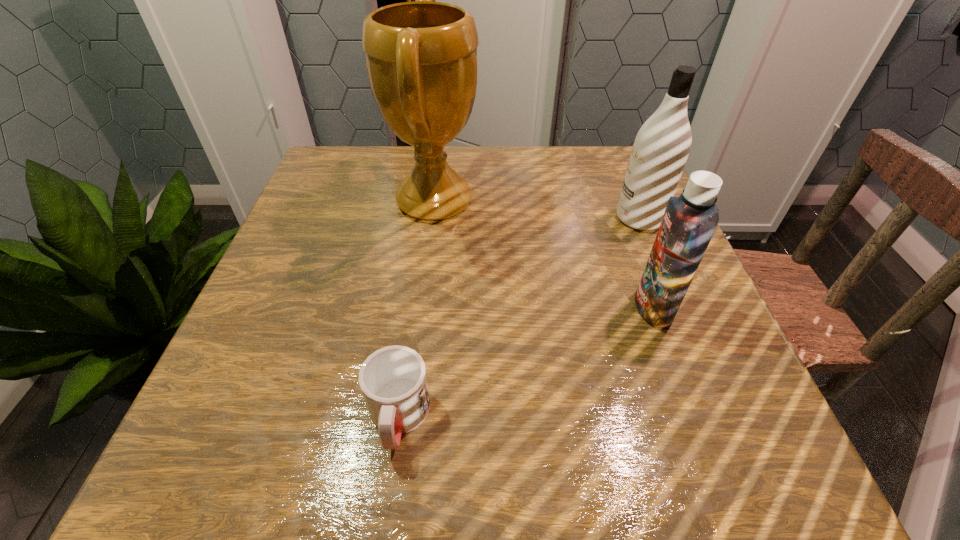
At what (x,y) coordinates should I click in order to perform the action: click on vacant area that lies between the nearer shampoo and the farther shampoo. Please return your answer as a coordinate pair (x, y). Image resolution: width=960 pixels, height=540 pixels. Looking at the image, I should click on (646, 263).

Find the location of a particular element. Image resolution: width=960 pixels, height=540 pixels. vacant area that lies between the tallest object and the second shortest object is located at coordinates (544, 254).

You are a GUI agent. You are given a task and a screenshot of the screen. Output one action in this format:
    pyautogui.click(x=<x>, y=<y>)
    Task: Click on the vacant space that is in between the award and the nearest object
    The width and height of the screenshot is (960, 540).
    Given the screenshot: What is the action you would take?
    pyautogui.click(x=417, y=309)

Locate which object is the third closest to the tallest object. Please provide its 2D coordinates. Your answer should be formatted as a tuple, i.e. [(x, y)], where the tuple contains the x and y coordinates of a point satisfying the conditions above.

[(661, 147)]

The image size is (960, 540). I want to click on object that stands as the closest to the taller shampoo, so click(690, 220).

What are the coordinates of `free spot that satisfies the following two spatial constraints: 1. on the front of the award with the decoration; 2. on the side of the nearest object with the handle` in the screenshot? It's located at (408, 417).

You are a GUI agent. You are given a task and a screenshot of the screen. Output one action in this format:
    pyautogui.click(x=<x>, y=<y>)
    Task: Click on the free space that satisfies the following two spatial constraints: 1. on the front label of the second nearest object; 2. on the side of the shortest object with the handle
    The height and width of the screenshot is (540, 960).
    Given the screenshot: What is the action you would take?
    pyautogui.click(x=694, y=417)

At what (x,y) coordinates should I click in order to perform the action: click on vacant space that satisfies the following two spatial constraints: 1. on the front label of the second nearest object; 2. on the side of the shortest object with the handle. Please return your answer as a coordinate pair (x, y). This screenshot has width=960, height=540. Looking at the image, I should click on (694, 417).

Find the location of a particular element. vacant region that satisfies the following two spatial constraints: 1. on the front label of the shorter shampoo; 2. on the side of the shortest object with the handle is located at coordinates (694, 417).

You are a GUI agent. You are given a task and a screenshot of the screen. Output one action in this format:
    pyautogui.click(x=<x>, y=<y>)
    Task: Click on the free location that satisfies the following two spatial constraints: 1. on the front label of the nearer shampoo; 2. on the side of the nearest object with the handle
    
    Given the screenshot: What is the action you would take?
    pyautogui.click(x=694, y=417)